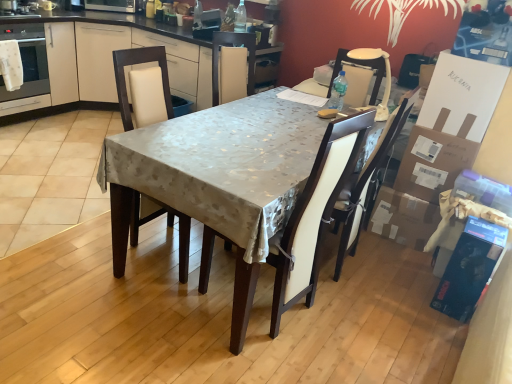
What are the coordinates of `free point in front of white leather chair at center, placed as the second chair when sorted from left to right` in the screenshot? It's located at (238, 357).